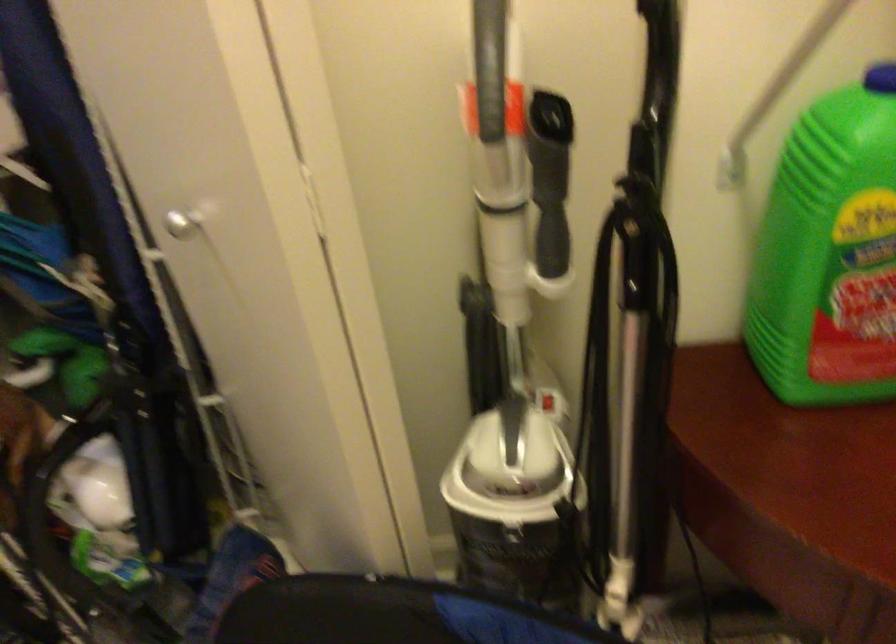
This screenshot has height=644, width=896. Find the location of `silver door knob`. silver door knob is located at coordinates (184, 222).